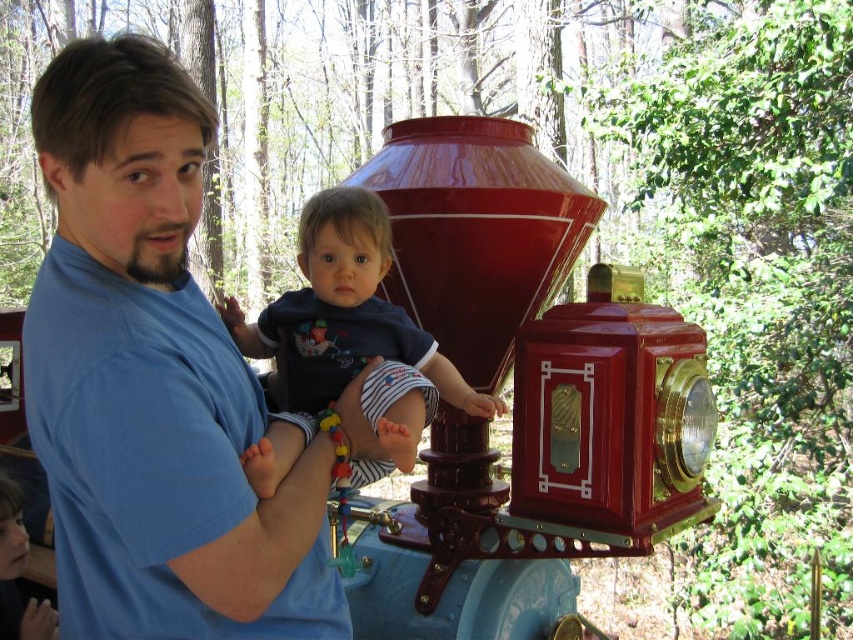
Does blue cotton shirt at center come in front of dark blue cotton shirt at center?

Yes, blue cotton shirt at center is in front of dark blue cotton shirt at center.

Is point (106, 307) positioned behind point (264, 458)?

No.

Is point (64, 403) farther from camera compared to point (326, 212)?

No, (64, 403) is closer to viewer.

Image resolution: width=853 pixels, height=640 pixels. What are the coordinates of `blue cotton shirt at center` in the screenshot? It's located at (154, 380).